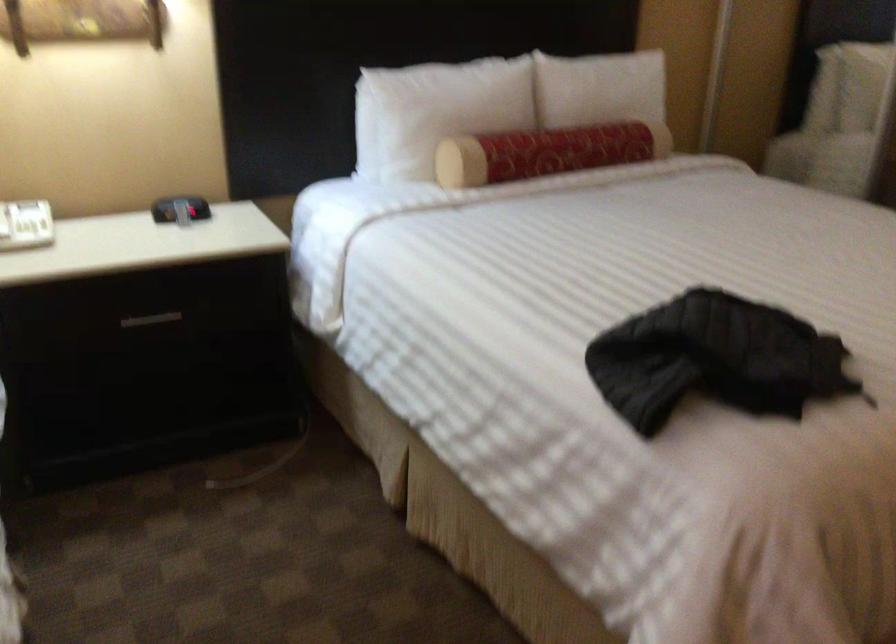
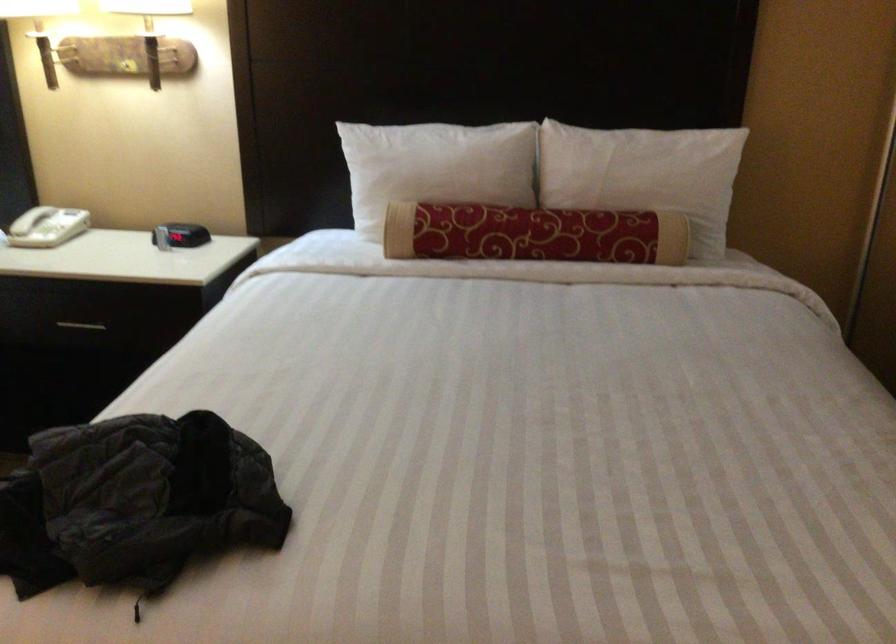
Where in the second image is the point corresponding to (179,209) from the first image?

(148, 230)